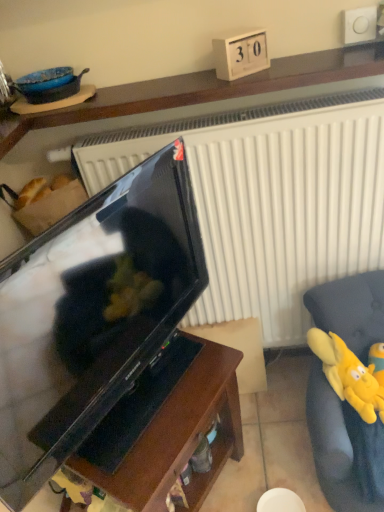
Question: Can you confirm if wooden shelf at upper center, the third furniture in the bottom-to-top sequence, is thinner than matte black television at center?

Choices:
 (A) yes
 (B) no

Answer: (B)

Question: Does wooden shelf at upper center, which ranks as the 1th furniture in top-to-bottom order, have a greater height compared to matte black television at center?

Choices:
 (A) no
 (B) yes

Answer: (A)

Question: Does wooden shelf at upper center, which ranks as the 1th furniture in top-to-bottom order, have a lesser height compared to matte black television at center?

Choices:
 (A) no
 (B) yes

Answer: (B)

Question: Does wooden shelf at upper center, which ranks as the 1th furniture in top-to-bottom order, have a smaller size compared to matte black television at center?

Choices:
 (A) no
 (B) yes

Answer: (B)

Question: Is wooden shelf at upper center, the third furniture in the bottom-to-top sequence, located outside matte black television at center?

Choices:
 (A) yes
 (B) no

Answer: (A)

Question: Is wooden shelf at upper center, which ranks as the 1th furniture in top-to-bottom order, positioned with its back to matte black television at center?

Choices:
 (A) no
 (B) yes

Answer: (A)

Question: Is yellow plush toy at right, the second furniture when ordered from top to bottom, outside matte black television at center?

Choices:
 (A) yes
 (B) no

Answer: (A)

Question: Is yellow plush toy at right, which is counted as the 2th furniture, starting from the bottom, thinner than matte black television at center?

Choices:
 (A) no
 (B) yes

Answer: (A)

Question: Is yellow plush toy at right, which is counted as the 2th furniture, starting from the bottom, shorter than matte black television at center?

Choices:
 (A) no
 (B) yes

Answer: (B)

Question: Is yellow plush toy at right, which is counted as the 2th furniture, starting from the bottom, turned away from matte black television at center?

Choices:
 (A) no
 (B) yes

Answer: (A)

Question: Is yellow plush toy at right, which is counted as the 2th furniture, starting from the bottom, with matte black television at center?

Choices:
 (A) yes
 (B) no

Answer: (B)

Question: From the image's perspective, is yellow plush toy at right, which is counted as the 2th furniture, starting from the bottom, under matte black television at center?

Choices:
 (A) yes
 (B) no

Answer: (A)

Question: Would you say yellow plush toy at right is a long distance from matte black television at center?

Choices:
 (A) no
 (B) yes

Answer: (A)